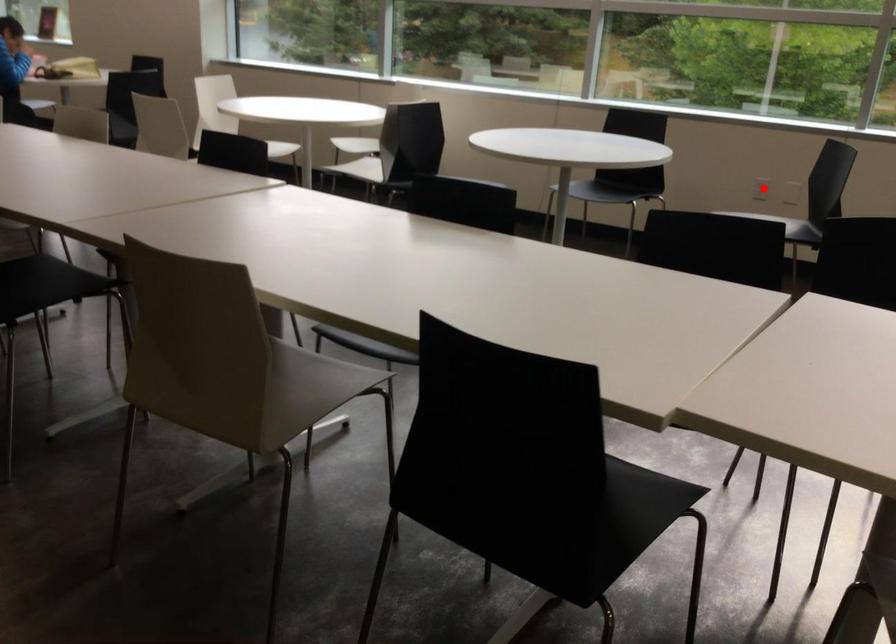
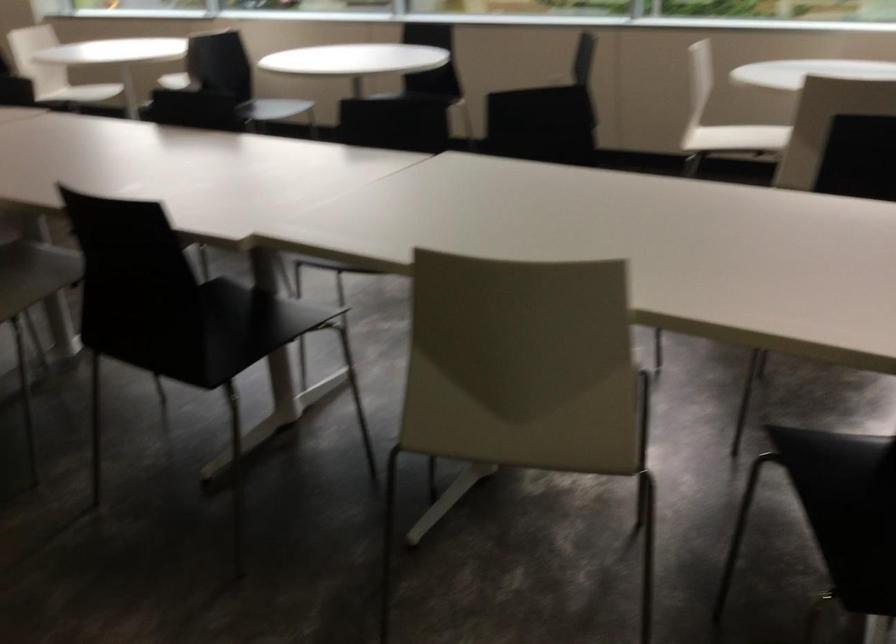
Question: I am providing you with two images of the same scene from different viewpoints. A red point is marked on the first image. Can you still see the location of the red point in image 2?

Choices:
 (A) Yes
 (B) No

Answer: (B)